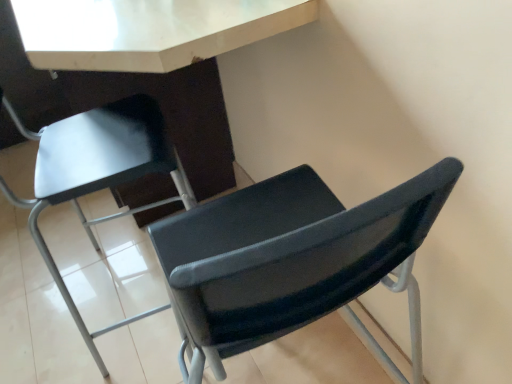
This screenshot has height=384, width=512. Describe the element at coordinates (98, 174) in the screenshot. I see `matte black chair at upper right` at that location.

Find the location of `matte black chair at upper right`. matte black chair at upper right is located at coordinates (98, 174).

This screenshot has height=384, width=512. I want to click on matte black chair at upper right, so click(98, 174).